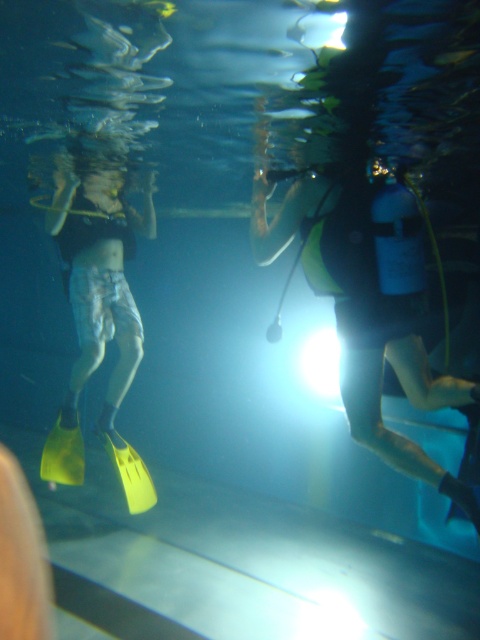
You are a scuba diver preparing to navigate an underwater cave. You have a yellow matte scuba gear at center. Based on the coordinates provided, can you determine if the gear is positioned centrally enough to avoid the cave walls?

The yellow matte scuba gear at center is positioned at coordinates point [361,317], which is very close to the center of the frame. This central positioning should help avoid the cave walls effectively.

You are a scuba diver navigating an underwater environment. You see two points marked in the scene. The first point is at coordinates point [128,472] and the second point is at point [137,486]. Which point is closer to you as you face the image?

Point [128,472] is in front of point [137,486], so it is closer to you as you face the image.

You are a scuba diver planning to swim towards the bright light source at the bottom right corner. Based on the position of the yellow rubber fins at left, which direction should you move relative to the fins to reach the light?

The yellow rubber fins at left are located at point 0.497 on the x axis and 0.200 on the y axis. Since the light is at the bottom right corner, you should move towards the lower right direction from the yellow rubber fins at left to reach the light source.